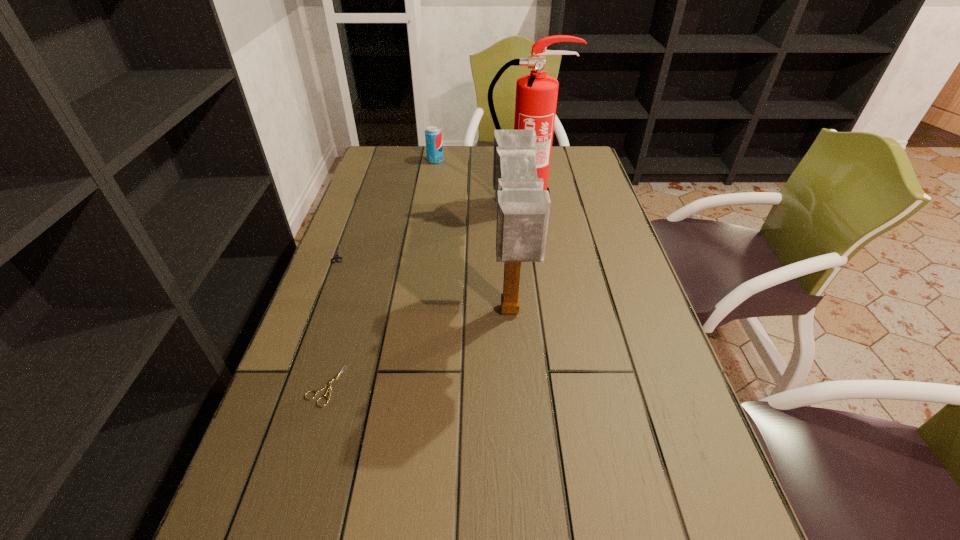
Where is `the fourth nearest object`? The image size is (960, 540). the fourth nearest object is located at coordinates (536, 94).

This screenshot has width=960, height=540. I want to click on the tallest object, so click(536, 94).

Where is `the second tallest object`? The width and height of the screenshot is (960, 540). the second tallest object is located at coordinates (523, 208).

This screenshot has width=960, height=540. In order to click on mallet in this screenshot , I will do `click(523, 208)`.

You are a GUI agent. You are given a task and a screenshot of the screen. Output one action in this format:
    pyautogui.click(x=<x>, y=<y>)
    Task: Click on the third tallest object
    This screenshot has width=960, height=540.
    Given the screenshot: What is the action you would take?
    pyautogui.click(x=433, y=135)

This screenshot has height=540, width=960. Find the location of `soda can`. soda can is located at coordinates (433, 135).

This screenshot has height=540, width=960. In order to click on the farther shears in this screenshot , I will do `click(336, 257)`.

Identify the location of the leftmost object. The height and width of the screenshot is (540, 960). (336, 257).

Identify the location of the right shears. The height and width of the screenshot is (540, 960). (328, 385).

The height and width of the screenshot is (540, 960). I want to click on the fourth object from right to left, so click(x=328, y=385).